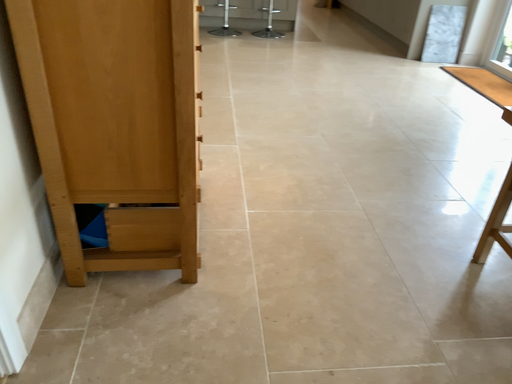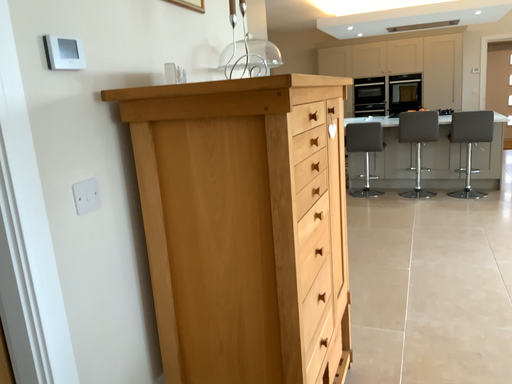
Question: How did the camera likely rotate when shooting the video?

Choices:
 (A) rotated upward
 (B) rotated downward

Answer: (A)